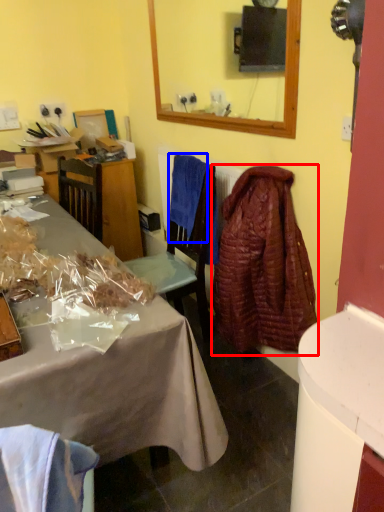
Question: Which of the following is the closest to the observer, robe (highlighted by a red box) or cloth (highlighted by a blue box)?

Choices:
 (A) robe
 (B) cloth

Answer: (A)